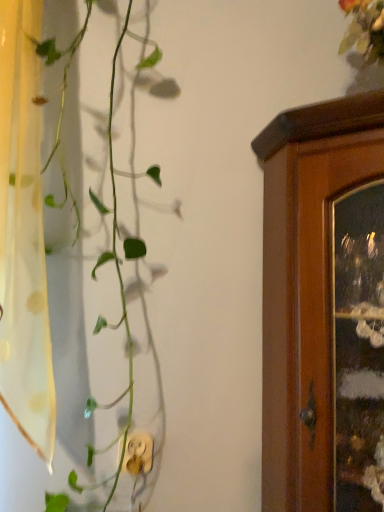
Question: Should I look upward or downward to see translucent yellow curtain at left?

Choices:
 (A) down
 (B) up

Answer: (B)